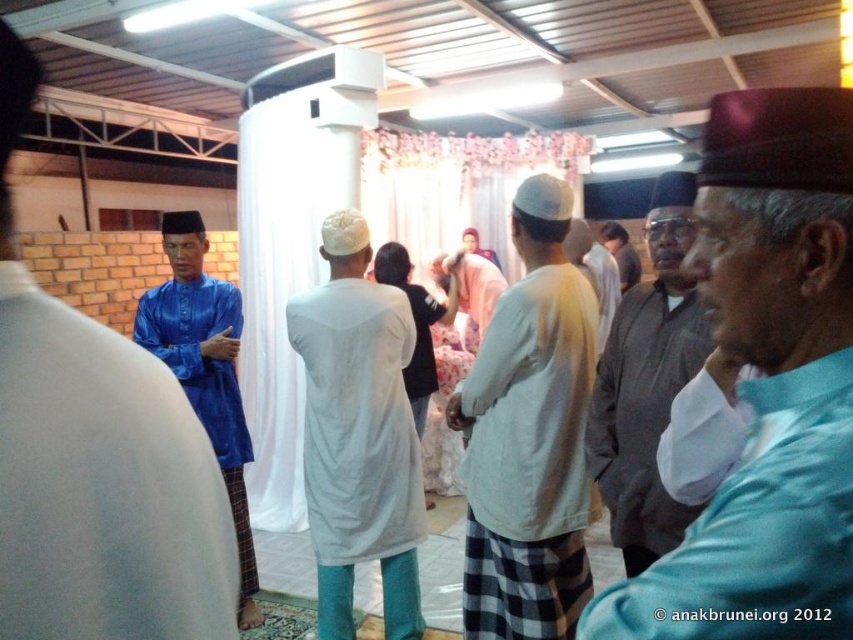
Is blue fabric mannequin at left wider than pink satin robe at center?

No.

Does blue fabric mannequin at left have a lesser width compared to pink satin robe at center?

Correct, blue fabric mannequin at left's width is less than pink satin robe at center's.

Who is more forward, (83,532) or (466,323)?

Positioned in front is point (83,532).

Identify the location of blue fabric mannequin at left. This screenshot has height=640, width=853. (96, 461).

Is light blue shirt at center positioned before gray matte jacket at center?

Yes, it is in front of gray matte jacket at center.

The height and width of the screenshot is (640, 853). What do you see at coordinates (767, 384) in the screenshot?
I see `light blue shirt at center` at bounding box center [767, 384].

Image resolution: width=853 pixels, height=640 pixels. I want to click on light blue shirt at center, so click(767, 384).

Which is in front, point (810, 376) or point (494, 296)?

Positioned in front is point (810, 376).

Which is more to the right, light blue shirt at center or pink satin robe at center?

pink satin robe at center

Identify the location of light blue shirt at center. 767,384.